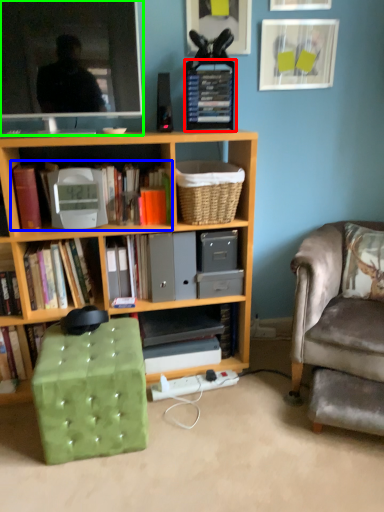
Question: Estimate the real-world distances between objects in this image. Which object is closer to paperback book (highlighted by a red box), book (highlighted by a blue box) or television (highlighted by a green box)?

Choices:
 (A) book
 (B) television

Answer: (B)